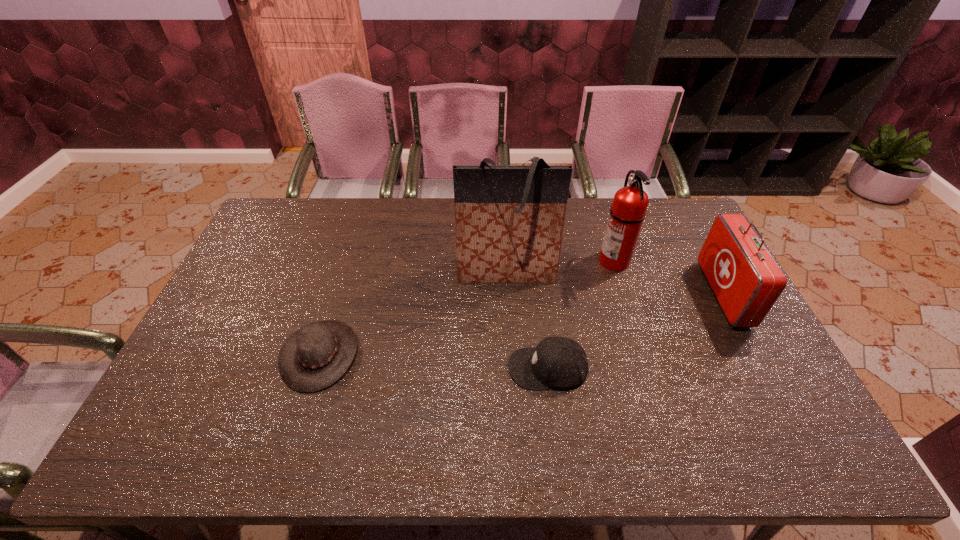
Image resolution: width=960 pixels, height=540 pixels. In order to click on the tallest object in this screenshot , I will do `click(509, 219)`.

Identify the location of fire extinguisher. This screenshot has width=960, height=540. (630, 203).

What are the coordinates of `the second object from right to left` in the screenshot? It's located at (630, 203).

Where is `the rightmost object`? The width and height of the screenshot is (960, 540). the rightmost object is located at coordinates (746, 280).

This screenshot has width=960, height=540. Find the location of `the third shortest object`. the third shortest object is located at coordinates (746, 280).

Where is `cap`? cap is located at coordinates (559, 363).

Locate an element on the screen. the leftmost object is located at coordinates (317, 355).

The image size is (960, 540). In order to click on vacant region located 0.400m on the front-facing side of the tallest object in this screenshot , I will do `click(515, 409)`.

Locate an element on the screen. vacant space located 0.090m at the nozzle of the second object from right to left is located at coordinates (571, 261).

Where is `vacant space located at the nozzle of the second object from right to left`? Image resolution: width=960 pixels, height=540 pixels. vacant space located at the nozzle of the second object from right to left is located at coordinates (554, 261).